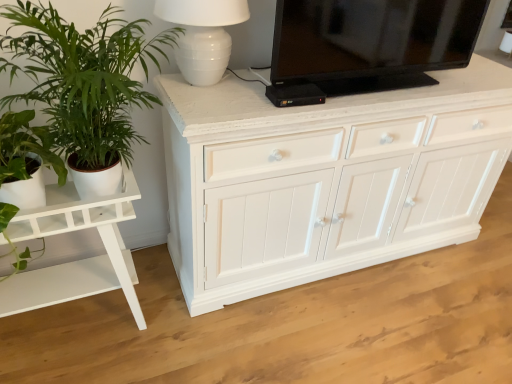
Where is `unoccupied region to the right of white glossy table at left`? The image size is (512, 384). unoccupied region to the right of white glossy table at left is located at coordinates (179, 337).